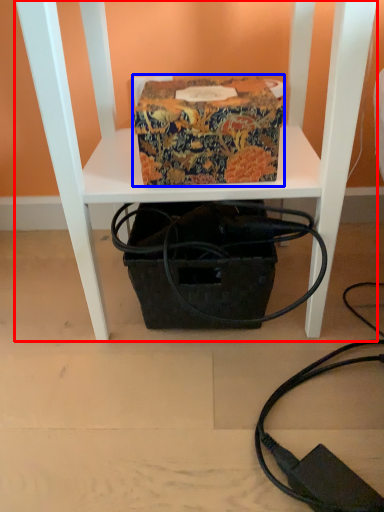
Question: Which object appears farthest to the camera in this image, furniture (highlighted by a red box) or cardboard box (highlighted by a blue box)?

Choices:
 (A) furniture
 (B) cardboard box

Answer: (B)